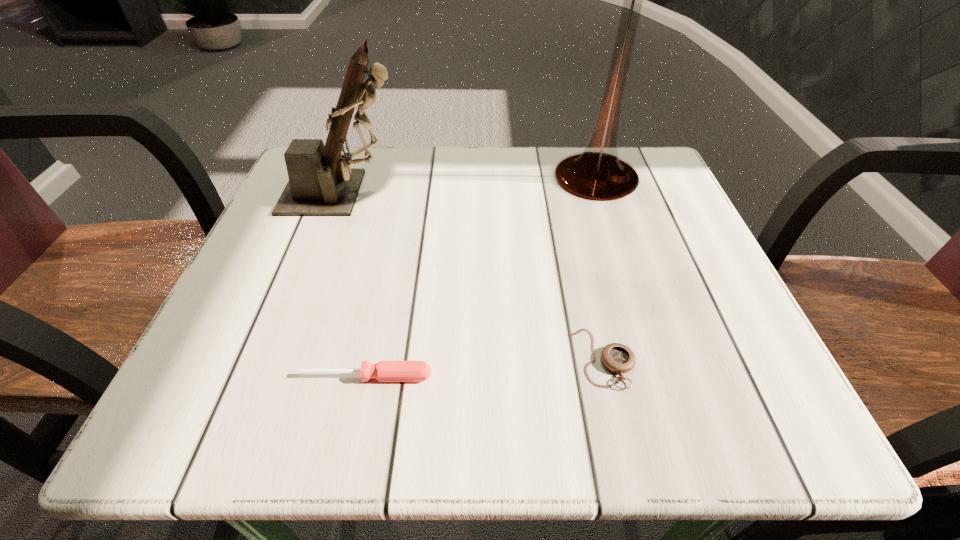
At what (x,y) coordinates should I click in order to perform the action: click on free space that satisfies the following two spatial constraints: 1. on the front-facing side of the screwdriver; 2. on the left side of the figurine. Please return your answer as a coordinate pair (x, y). The height and width of the screenshot is (540, 960). Looking at the image, I should click on (278, 376).

This screenshot has width=960, height=540. In order to click on free spot that satisfies the following two spatial constraints: 1. on the front-facing side of the pocket watch; 2. on the right side of the third shortest object in this screenshot , I will do point(285,358).

Identify the location of free space that satisfies the following two spatial constraints: 1. on the front-facing side of the second shortest object; 2. on the left side of the third shortest object. (278, 376).

Locate an element on the screen. The width and height of the screenshot is (960, 540). vacant space that satisfies the following two spatial constraints: 1. above the cylindrical shade of the table lamp; 2. on the front-facing side of the figurine is located at coordinates (601, 193).

The image size is (960, 540). In order to click on vacant area that satisfies the following two spatial constraints: 1. on the front-facing side of the pocket watch; 2. on the right side of the third shortest object in this screenshot , I will do `click(285, 358)`.

Locate an element on the screen. The width and height of the screenshot is (960, 540). free point that satisfies the following two spatial constraints: 1. above the cylindrical shade of the tallest object; 2. on the front-facing side of the third shortest object is located at coordinates (601, 193).

This screenshot has height=540, width=960. Identify the location of free space that satisfies the following two spatial constraints: 1. on the back side of the screwdriver; 2. on the front-facing side of the third shortest object. (403, 193).

In order to click on free spot that satisfies the following two spatial constraints: 1. on the back side of the screwdriver; 2. on the front-facing side of the second tallest object in this screenshot , I will do `click(403, 193)`.